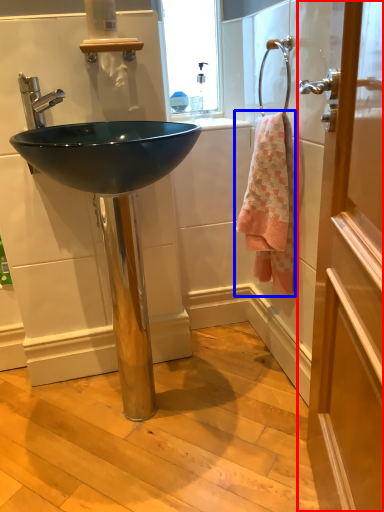
Question: Which object is further to the camera taking this photo, door (highlighted by a red box) or towel/napkin (highlighted by a blue box)?

Choices:
 (A) door
 (B) towel/napkin

Answer: (B)